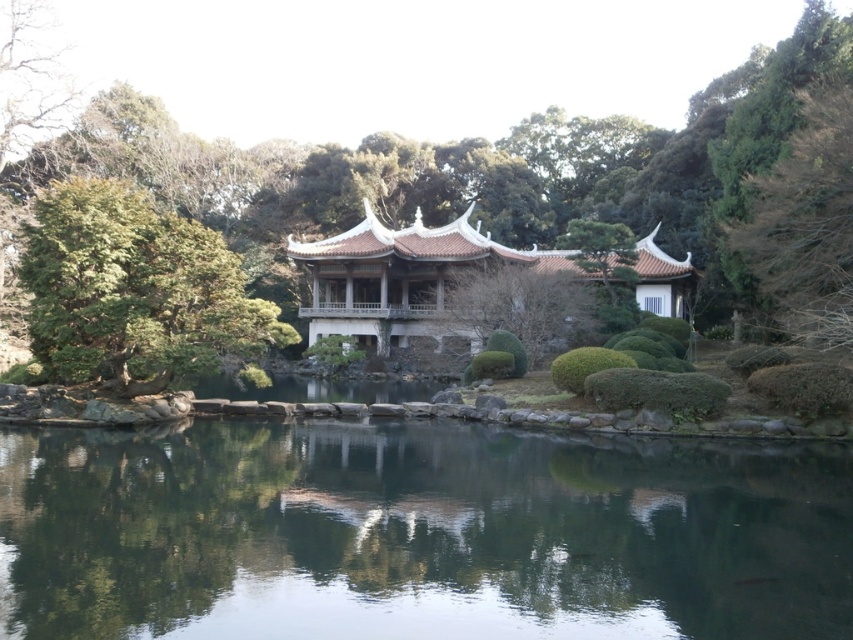
Does transparent glass water at center appear over green leafy tree at left?

Actually, transparent glass water at center is below green leafy tree at left.

Is transparent glass water at center to the right of green leafy tree at left from the viewer's perspective?

Indeed, transparent glass water at center is positioned on the right side of green leafy tree at left.

Does point (822, 582) lie behind point (193, 320)?

No, it is not.

Where is `transparent glass water at center`? Image resolution: width=853 pixels, height=640 pixels. transparent glass water at center is located at coordinates (418, 532).

How far apart are transparent glass water at center and wooden gazebo at center?

26.05 meters

Can you confirm if transparent glass water at center is positioned to the right of wooden gazebo at center?

Incorrect, transparent glass water at center is not on the right side of wooden gazebo at center.

The image size is (853, 640). Describe the element at coordinates (418, 532) in the screenshot. I see `transparent glass water at center` at that location.

Find the location of a particular element. This screenshot has height=640, width=853. transparent glass water at center is located at coordinates (418, 532).

Can you confirm if green leafy tree at center is wider than green leafy tree at left?

Indeed, green leafy tree at center has a greater width compared to green leafy tree at left.

Between green leafy tree at center and green leafy tree at left, which one appears on the right side from the viewer's perspective?

green leafy tree at center is more to the right.

Does point (738, 144) come closer to viewer compared to point (296, 332)?

No, it is not.

Where is `green leafy tree at center`? green leafy tree at center is located at coordinates (482, 172).